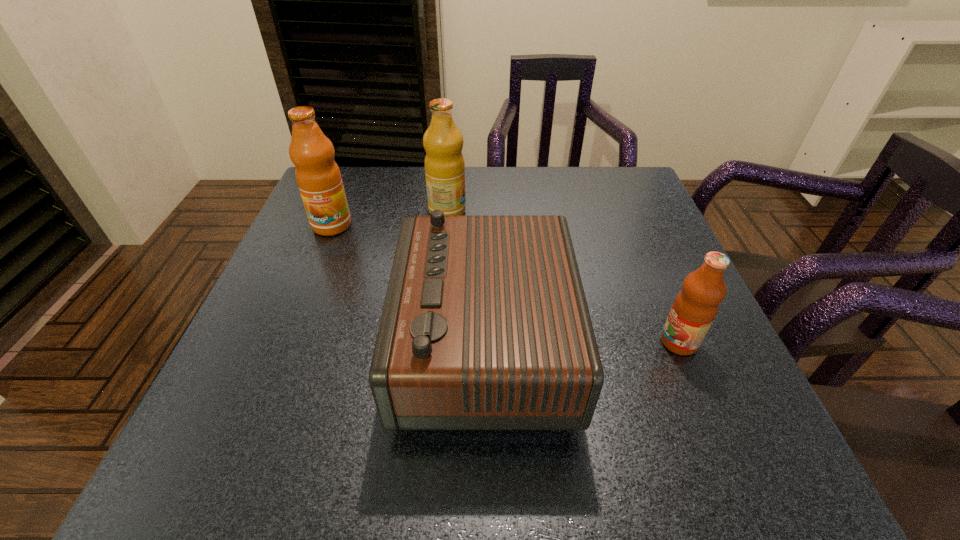
Identify the location of the closest fruit juice to the leftmost object. Image resolution: width=960 pixels, height=540 pixels. (444, 163).

The image size is (960, 540). I want to click on free space that satisfies the following two spatial constraints: 1. on the front label of the second fruit juice from right to left; 2. on the label side of the leftmost object, so click(446, 225).

Find the location of `free space that satisfies the following two spatial constraints: 1. on the front label of the second fruit juice from right to left; 2. on the label side of the leftmost object`. free space that satisfies the following two spatial constraints: 1. on the front label of the second fruit juice from right to left; 2. on the label side of the leftmost object is located at coordinates (446, 225).